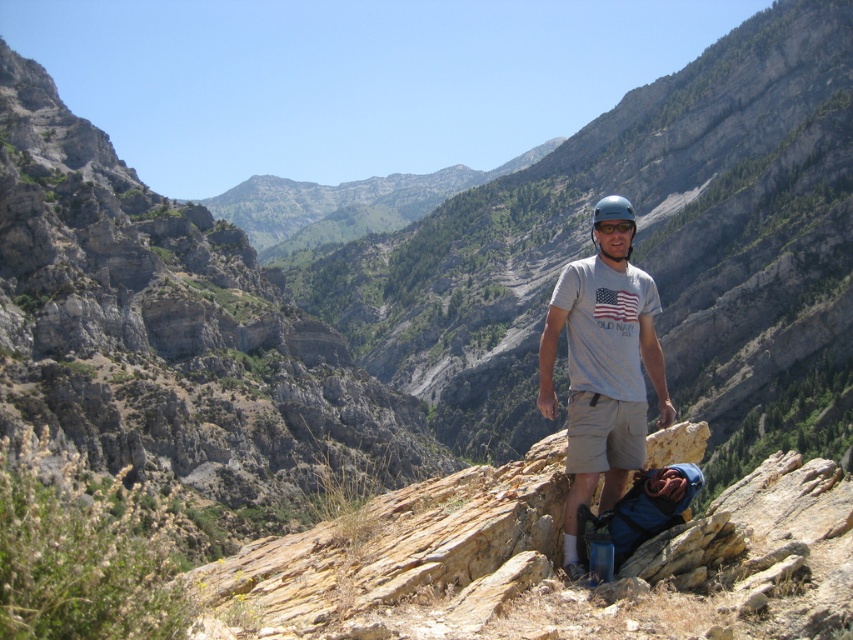
Between gray cotton t-shirt at center and blue matte helmet at center, which one appears on the right side from the viewer's perspective?

blue matte helmet at center

What do you see at coordinates (602, 365) in the screenshot? Image resolution: width=853 pixels, height=640 pixels. I see `gray cotton t-shirt at center` at bounding box center [602, 365].

You are a GUI agent. You are given a task and a screenshot of the screen. Output one action in this format:
    pyautogui.click(x=<x>, y=<y>)
    Task: Click on the gray cotton t-shirt at center
    This screenshot has height=640, width=853.
    Given the screenshot: What is the action you would take?
    pyautogui.click(x=602, y=365)